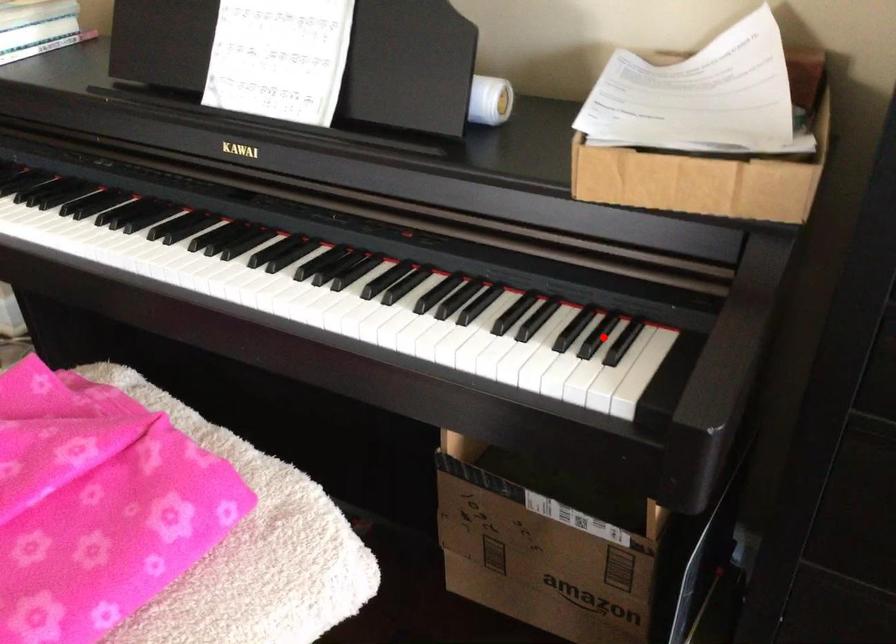
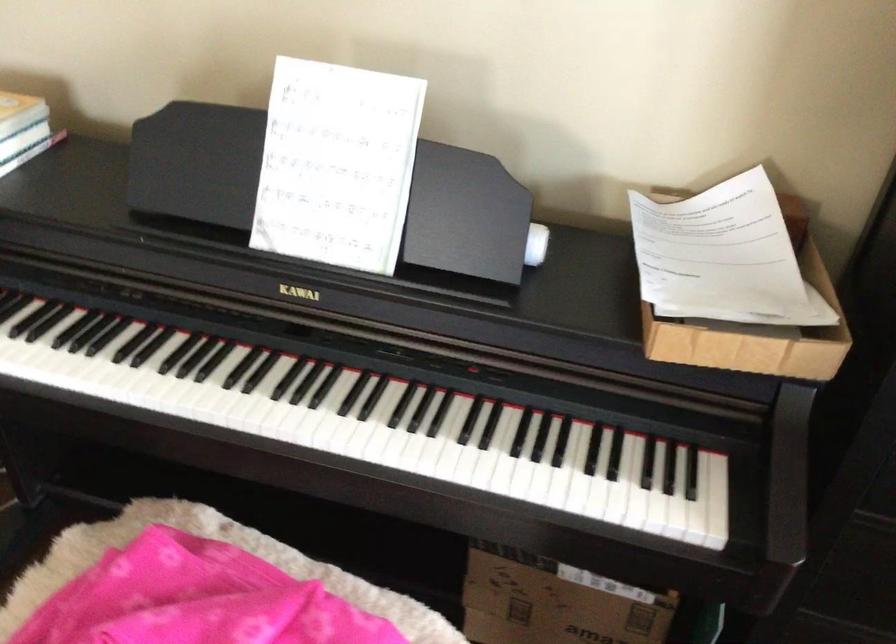
Where in the second image is the point corresponding to the highlighted location from the first image?

(669, 467)